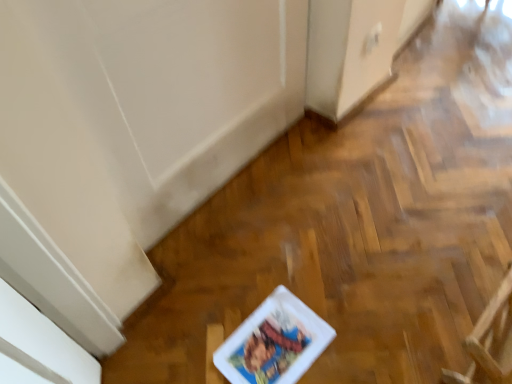
Where is `vacant space behind white glossy comic book at center`? Image resolution: width=512 pixels, height=384 pixels. vacant space behind white glossy comic book at center is located at coordinates [x=263, y=263].